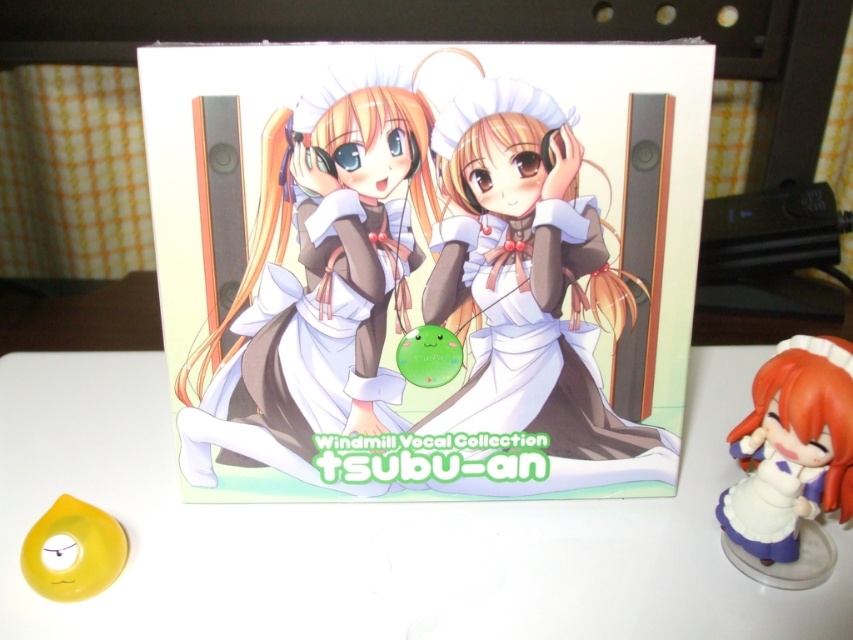
Between point (585, 253) and point (41, 576), which one is positioned in front?

Positioned in front is point (41, 576).

Is matte white dress at center in front of translucent yellow ring at center?

No.

What do you see at coordinates (527, 280) in the screenshot? Image resolution: width=853 pixels, height=640 pixels. I see `matte white dress at center` at bounding box center [527, 280].

Find the location of a particular element. The width and height of the screenshot is (853, 640). matte white dress at center is located at coordinates [x=527, y=280].

Does point (241, 536) lie in front of point (825, 424)?

No.

Locate an element on the screen. white glossy table at center is located at coordinates (378, 534).

Where is `white glossy table at center`? white glossy table at center is located at coordinates (378, 534).

Does matte white dress at center have a smaller size compared to white glossy figurine at lower right?

No, matte white dress at center is not smaller than white glossy figurine at lower right.

Does point (529, 284) come closer to viewer compared to point (833, 449)?

That is False.

Does point (479, 124) lie in front of point (753, 509)?

Yes, it is in front of point (753, 509).

This screenshot has width=853, height=640. I want to click on matte white dress at center, so click(527, 280).